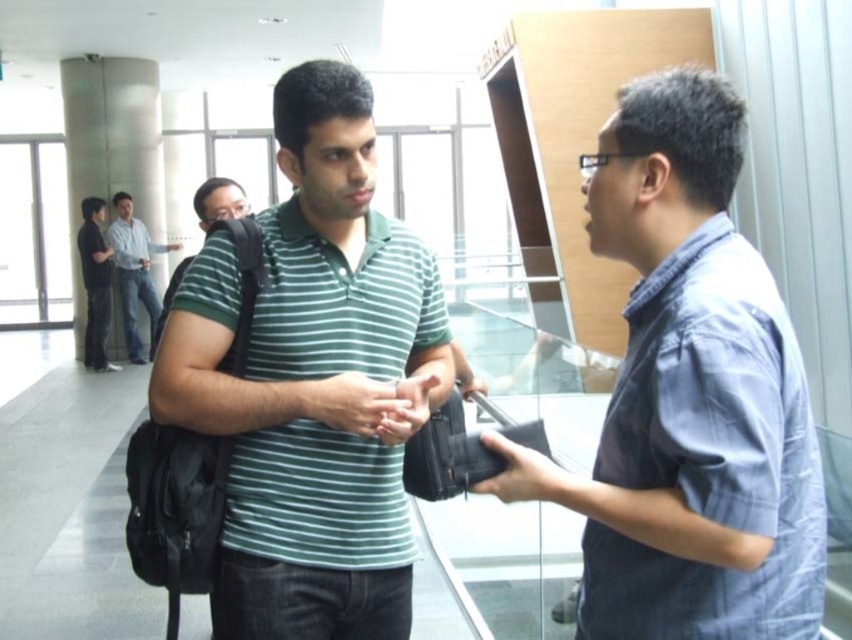
Question: Which of the following is the closest to the observer?

Choices:
 (A) matte green shirt at center
 (B) blue denim shirt at center

Answer: (B)

Question: Considering the real-world distances, which object is farthest from the dark gray pants at left?

Choices:
 (A) matte green shirt at center
 (B) light blue shirt at upper left
 (C) green striped polo shirt at center

Answer: (A)

Question: Which point appears closest to the camera in this image?

Choices:
 (A) (164, 337)
 (B) (776, 442)
 (C) (396, 400)
 (D) (135, 257)

Answer: (B)

Question: Does matte green shirt at center have a larger size compared to light blue shirt at upper left?

Choices:
 (A) yes
 (B) no

Answer: (B)

Question: Does green striped polo shirt at center appear on the right side of dark gray pants at left?

Choices:
 (A) yes
 (B) no

Answer: (A)

Question: Is matte green shirt at center above dark gray pants at left?

Choices:
 (A) yes
 (B) no

Answer: (B)